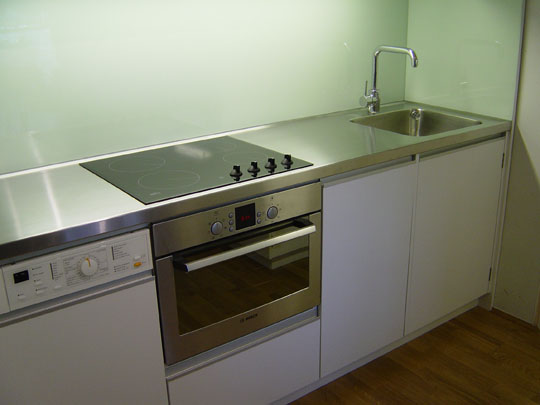
Identify the location of cabinet doors. (464, 232), (371, 258), (260, 359), (107, 352).